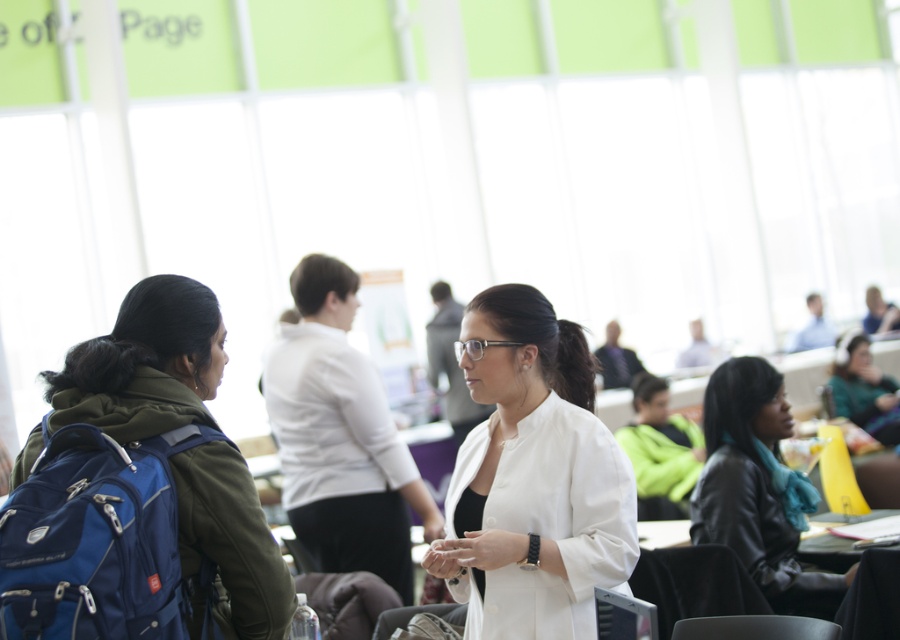
Question: Can you confirm if black leather jacket at lower right is wider than matte green sweater at right?

Choices:
 (A) yes
 (B) no

Answer: (B)

Question: Which is farther from the matte blue backpack at left?

Choices:
 (A) white matte blazer at center
 (B) matte green sweater at right
 (C) black leather jacket at lower right

Answer: (B)

Question: Does matte blue backpack at left have a lesser width compared to black leather jacket at lower right?

Choices:
 (A) no
 (B) yes

Answer: (A)

Question: Which of these objects is positioned closest to the white matte blazer at center?

Choices:
 (A) matte blue backpack at left
 (B) black leather jacket at lower right

Answer: (A)

Question: Which of the following is the farthest from the observer?

Choices:
 (A) (729, 419)
 (B) (497, 461)
 (C) (136, 349)
 (D) (864, 401)

Answer: (D)

Question: Is black leather jacket at lower right positioned behind matte green sweater at right?

Choices:
 (A) yes
 (B) no

Answer: (B)